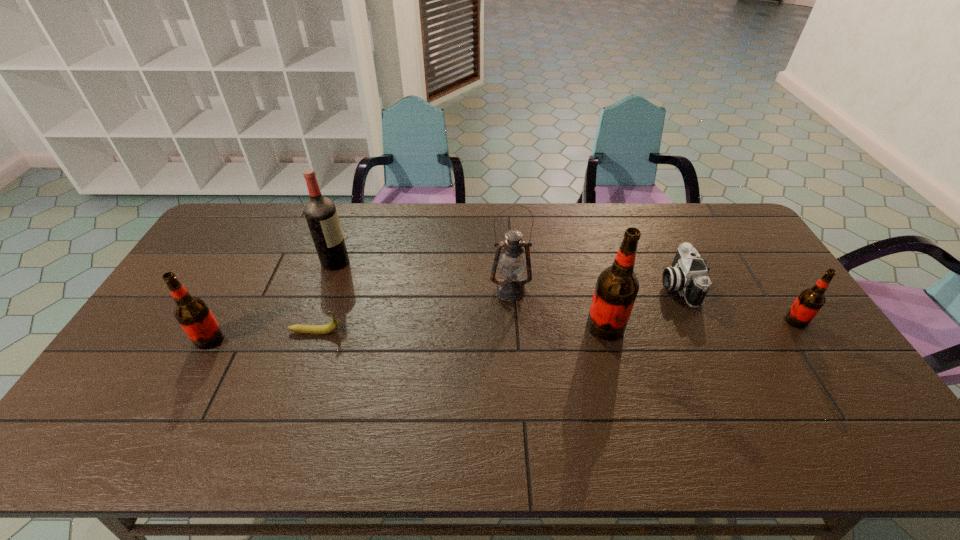
In the image, there is a desktop. Where is `vacant space at the far edge`? The width and height of the screenshot is (960, 540). vacant space at the far edge is located at coordinates (443, 214).

Locate an element on the screen. This screenshot has width=960, height=540. free space at the near edge of the desktop is located at coordinates (180, 411).

This screenshot has height=540, width=960. What are the coordinates of `free space at the left edge` in the screenshot? It's located at [216, 255].

Find the location of `free space at the far right corner of the desktop`. free space at the far right corner of the desktop is located at coordinates (703, 232).

Identify the location of unoccupied position between the banana and the liquor. This screenshot has height=540, width=960. (325, 297).

Where is `free spot between the second object from right to left and the fifth object from left to right`? The image size is (960, 540). free spot between the second object from right to left and the fifth object from left to right is located at coordinates (641, 306).

This screenshot has width=960, height=540. Find the location of `vacant space that is in between the second shortest root beer and the second object from right to left`. vacant space that is in between the second shortest root beer and the second object from right to left is located at coordinates pyautogui.click(x=444, y=312).

Locate an element on the screen. This screenshot has width=960, height=540. free space between the oil lamp and the leftmost root beer is located at coordinates (x=360, y=315).

Image resolution: width=960 pixels, height=540 pixels. I want to click on unoccupied position between the camera and the fourth object from right to left, so click(x=594, y=288).

Find the location of a particular element. The width and height of the screenshot is (960, 540). vacant space that's between the oil lamp and the fifth object from left to right is located at coordinates (558, 309).